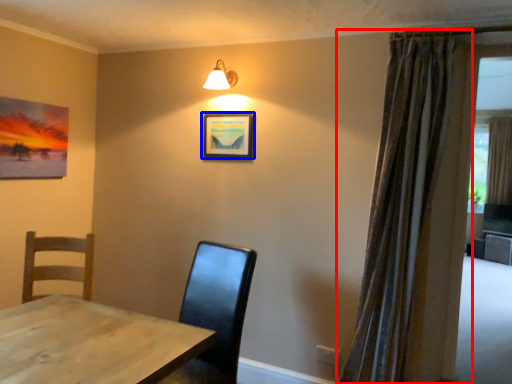
Question: Which object appears farthest to the camera in this image, curtain (highlighted by a red box) or picture frame (highlighted by a blue box)?

Choices:
 (A) curtain
 (B) picture frame

Answer: (B)